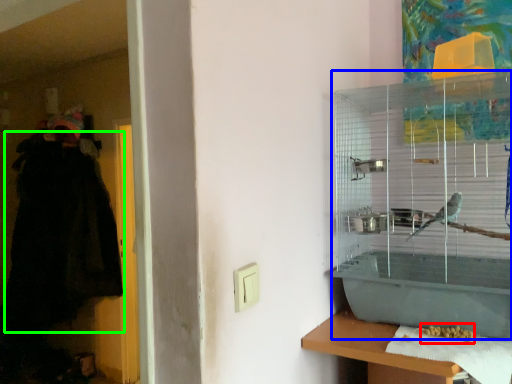
Question: Based on their relative distances, which object is nearer to food (highlighted by a red box)? Choose from bird cage (highlighted by a blue box) and robe (highlighted by a green box).

Choices:
 (A) bird cage
 (B) robe

Answer: (A)